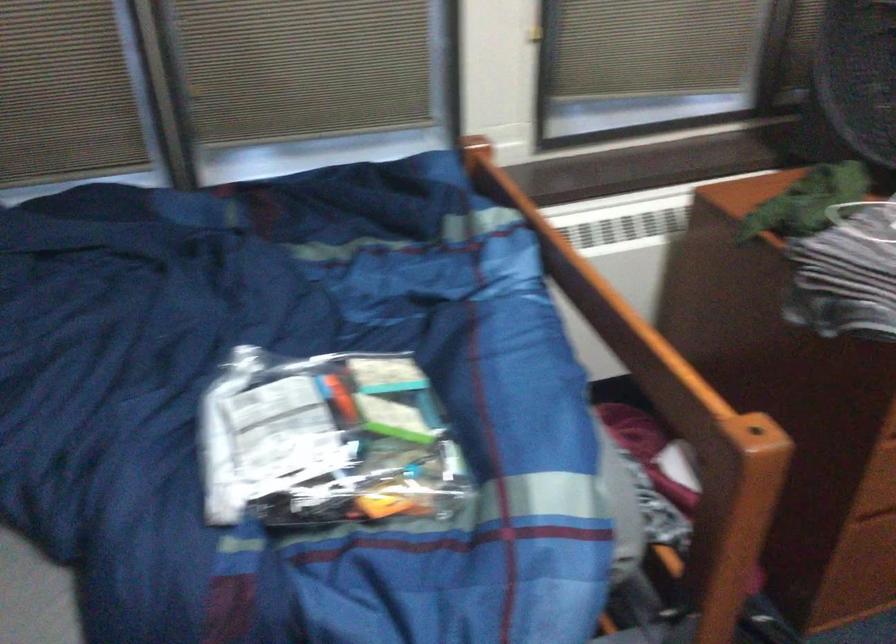
Locate an element on the screen. This screenshot has height=644, width=896. plastic bag of items is located at coordinates (325, 440).